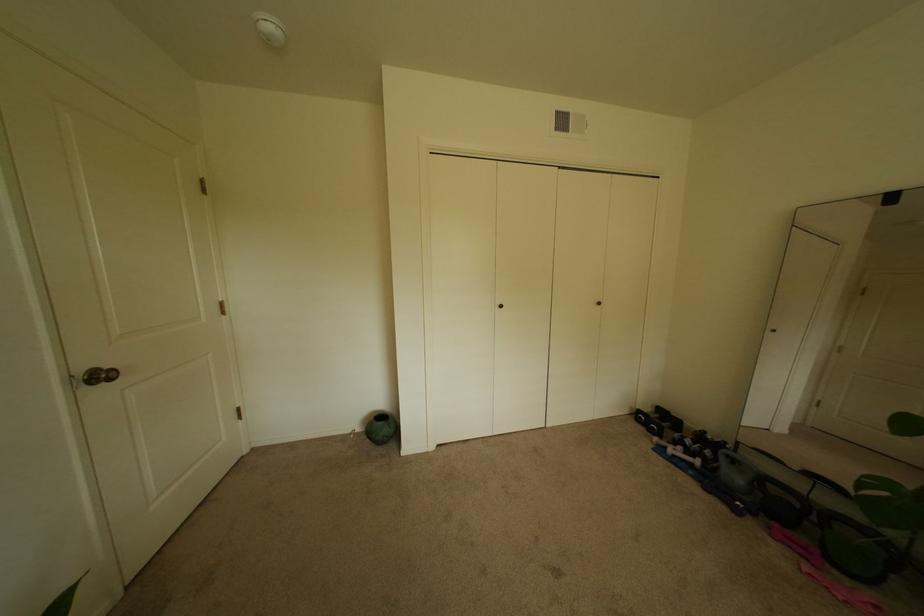
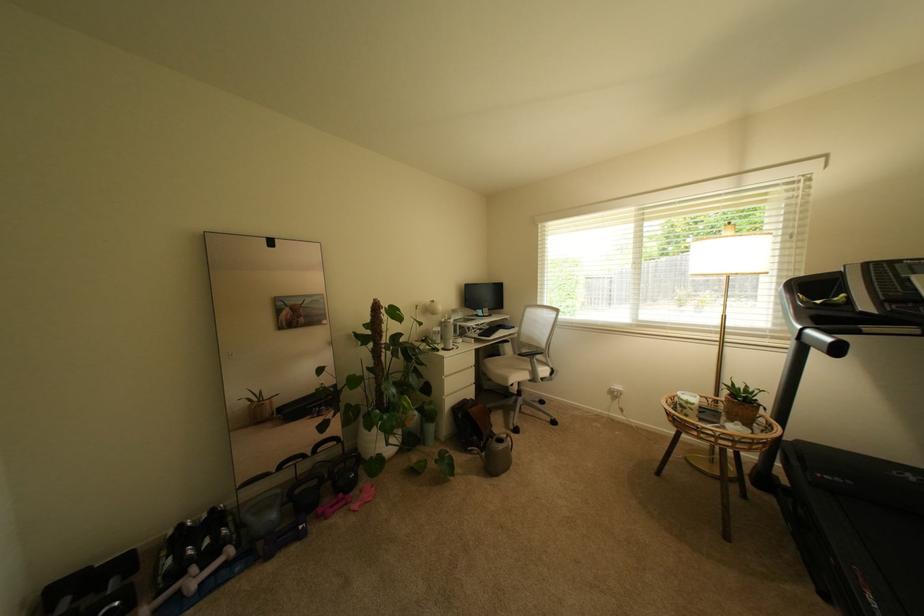
Find the pixel in the second image that matches [713,434] in the first image.

(188, 527)